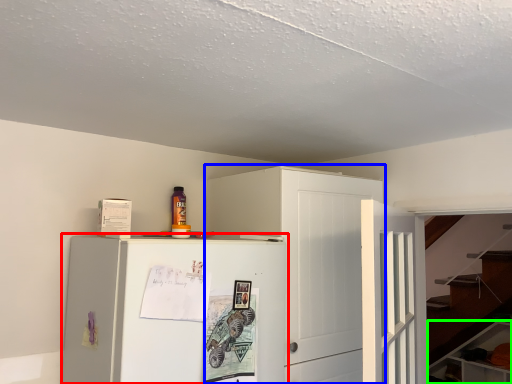
Question: Which is nearer to the refrigerator (highlighted by a red box)? cabinetry (highlighted by a blue box) or cabinetry (highlighted by a green box).

Choices:
 (A) cabinetry
 (B) cabinetry

Answer: (A)